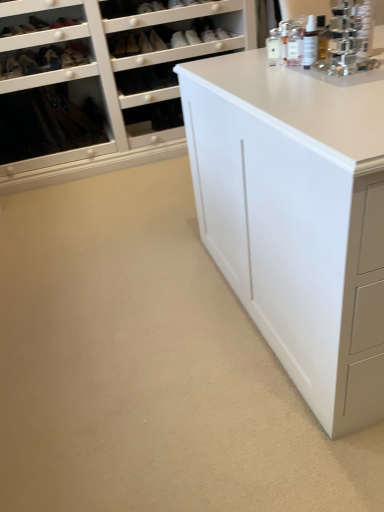
Where is `matte black shoe at upper left, the 1th shoe from the left`? matte black shoe at upper left, the 1th shoe from the left is located at coordinates (28, 63).

This screenshot has width=384, height=512. Describe the element at coordinates (28, 63) in the screenshot. I see `matte black shoe at upper left, the 1th shoe from the left` at that location.

Image resolution: width=384 pixels, height=512 pixels. In order to click on matte black shoe at upper left, the second shoe in the right-to-left sequence in this screenshot , I will do `click(77, 54)`.

At what (x,y) coordinates should I click in order to perform the action: click on clear plastic spray bottle at upper right, the second toiletry from the back. Please return your answer as a coordinate pair (x, y). This screenshot has width=384, height=512. Looking at the image, I should click on (310, 42).

Find the location of a particular element. The height and width of the screenshot is (512, 384). white glass bottle at upper right, arranged as the first toiletry when viewed from the left is located at coordinates (274, 47).

Is white glass bottle at upper right, acting as the first toiletry starting from the back, thinner than matte black shoe at upper left, the 2th shoe positioned from the left?

Correct, the width of white glass bottle at upper right, acting as the first toiletry starting from the back, is less than that of matte black shoe at upper left, the 2th shoe positioned from the left.

The height and width of the screenshot is (512, 384). I want to click on the 2nd shoe counting from the left of the white glass bottle at upper right, which is the second toiletry in right-to-left order, so click(77, 54).

Considering the sizes of objects white glass bottle at upper right, arranged as the first toiletry when viewed from the left, and matte black shoe at upper left, the second shoe in the right-to-left sequence, in the image provided, who is bigger, white glass bottle at upper right, arranged as the first toiletry when viewed from the left, or matte black shoe at upper left, the second shoe in the right-to-left sequence,?

Bigger between the two is matte black shoe at upper left, the second shoe in the right-to-left sequence.

Is point (277, 56) closer to viewer compared to point (64, 54)?

Yes, point (277, 56) is closer to viewer.

Between matte black shoe at upper left, the second shoe in the right-to-left sequence, and matte black shoe at upper left, the 1th shoe from the left, which one has larger width?

matte black shoe at upper left, the 1th shoe from the left.

Is matte black shoe at upper left, the 1th shoe from the left, surrounded by matte black shoe at upper left, the second shoe in the right-to-left sequence?

No, matte black shoe at upper left, the 1th shoe from the left, is not a part of matte black shoe at upper left, the second shoe in the right-to-left sequence.

What's the angular difference between matte black shoe at upper left, the second shoe in the right-to-left sequence, and matte black shoe at upper left, the 1th shoe from the left,'s facing directions?

2.57 degrees.

Looking at this image, is matte black shoe at upper left, the second shoe in the right-to-left sequence, not close to matte black shoe at upper left, the 1th shoe from the left?

No, there isn't a large distance between matte black shoe at upper left, the second shoe in the right-to-left sequence, and matte black shoe at upper left, the 1th shoe from the left.

Between point (29, 68) and point (278, 30), which one is positioned in front?

The point (278, 30) is in front.

Is matte black shoe at upper left, the 3th shoe viewed from the right, next to white glass bottle at upper right, acting as the first toiletry starting from the back, and touching it?

They are not placed beside each other.

Which object is wider, matte black shoe at upper left, the 1th shoe from the left, or white glass bottle at upper right, arranged as the first toiletry when viewed from the left?

matte black shoe at upper left, the 1th shoe from the left, is wider.

From a real-world perspective, count 1st shoes downward from the white glass bottle at upper right, acting as the first toiletry starting from the back, and point to it. Please provide its 2D coordinates.

[(28, 63)]

Between matte black shoe at upper left, the second shoe in the right-to-left sequence, and clear plastic spray bottle at upper right, the second toiletry from the back, which one has smaller size?

With smaller size is clear plastic spray bottle at upper right, the second toiletry from the back.

Is matte black shoe at upper left, the second shoe in the right-to-left sequence, positioned with its back to clear plastic spray bottle at upper right, the second toiletry from the back?

No, clear plastic spray bottle at upper right, the second toiletry from the back, is not at the back of matte black shoe at upper left, the second shoe in the right-to-left sequence.

Which point is more distant from viewer, (x=86, y=50) or (x=317, y=38)?

The point (x=86, y=50) is behind.

Is matte black shoe at upper left, the second shoe in the right-to-left sequence, with clear plastic spray bottle at upper right, which is the 1th toiletry in right-to-left order?

No, matte black shoe at upper left, the second shoe in the right-to-left sequence, is not next to clear plastic spray bottle at upper right, which is the 1th toiletry in right-to-left order.

From the image's perspective, count 1st shoes downward from the matte black shoe at upper center, positioned as the third shoe in left-to-right order, and point to it. Please provide its 2D coordinates.

[(77, 54)]

Between matte black shoe at upper left, the second shoe in the right-to-left sequence, and matte black shoe at upper center, arranged as the 1th shoe when viewed from the right, which one has larger size?

matte black shoe at upper left, the second shoe in the right-to-left sequence.

Are matte black shoe at upper left, the second shoe in the right-to-left sequence, and matte black shoe at upper center, arranged as the 1th shoe when viewed from the right, beside each other?

No, matte black shoe at upper left, the second shoe in the right-to-left sequence, is not making contact with matte black shoe at upper center, arranged as the 1th shoe when viewed from the right.

Who is shorter, matte black shoe at upper left, the second shoe in the right-to-left sequence, or matte black shoe at upper center, positioned as the third shoe in left-to-right order?

matte black shoe at upper center, positioned as the third shoe in left-to-right order, is shorter.

From the image's perspective, is white glass bottle at upper right, which is the second toiletry in right-to-left order, located beneath matte black shoe at upper left, the 1th shoe from the left?

Yes, from the image's perspective, white glass bottle at upper right, which is the second toiletry in right-to-left order, is below matte black shoe at upper left, the 1th shoe from the left.

Between white glass bottle at upper right, acting as the first toiletry starting from the back, and matte black shoe at upper left, the 1th shoe from the left, which one has larger size?

matte black shoe at upper left, the 1th shoe from the left.

Can you see white glass bottle at upper right, acting as the first toiletry starting from the back, touching matte black shoe at upper left, the 1th shoe from the left?

No, white glass bottle at upper right, acting as the first toiletry starting from the back, is not making contact with matte black shoe at upper left, the 1th shoe from the left.

Is point (273, 30) positioned after point (24, 59)?

No, it is in front of (24, 59).

The height and width of the screenshot is (512, 384). Find the location of `shoe that appears in front of the matte black shoe at upper center, arranged as the 1th shoe when viewed from the right`. shoe that appears in front of the matte black shoe at upper center, arranged as the 1th shoe when viewed from the right is located at coordinates (28, 63).

How many degrees apart are the facing directions of matte black shoe at upper center, arranged as the 1th shoe when viewed from the right, and matte black shoe at upper left, the 3th shoe viewed from the right?

They differ by 2.68 degrees in their facing directions.

Is matte black shoe at upper center, positioned as the third shoe in left-to-right order, oriented towards matte black shoe at upper left, the 1th shoe from the left?

No, matte black shoe at upper center, positioned as the third shoe in left-to-right order, is not oriented towards matte black shoe at upper left, the 1th shoe from the left.

Does point (149, 5) come farther from viewer compared to point (27, 72)?

No.

Identify the location of toiletry that is the 1st object to the right of the matte black shoe at upper left, the 2th shoe positioned from the left, starting at the anchor. (274, 47).

Starting from the matte black shoe at upper left, the 2th shoe positioned from the left, which shoe is the 2nd one in front? Please provide its 2D coordinates.

[(28, 63)]

Which object lies further to the anchor point matte black shoe at upper center, arranged as the 1th shoe when viewed from the right, clear plastic spray bottle at upper right, which is the 1th toiletry in right-to-left order, or matte black shoe at upper left, the second shoe in the right-to-left sequence?

clear plastic spray bottle at upper right, which is the 1th toiletry in right-to-left order, is positioned further to the anchor matte black shoe at upper center, arranged as the 1th shoe when viewed from the right.

Which object lies nearer to the anchor point matte black shoe at upper center, arranged as the 1th shoe when viewed from the right, clear plastic spray bottle at upper right, the second toiletry from the back, or white glass bottle at upper right, the second toiletry viewed from the front?

Based on the image, white glass bottle at upper right, the second toiletry viewed from the front, appears to be nearer to matte black shoe at upper center, arranged as the 1th shoe when viewed from the right.

Estimate the real-world distances between objects in this image. Which object is closer to white glass bottle at upper right, arranged as the first toiletry when viewed from the left, matte black shoe at upper left, the 3th shoe viewed from the right, or matte black shoe at upper left, the 2th shoe positioned from the left?

matte black shoe at upper left, the 2th shoe positioned from the left, lies closer to white glass bottle at upper right, arranged as the first toiletry when viewed from the left, than the other object.

From the image, which object appears to be nearer to clear plastic spray bottle at upper right, which is the 1th toiletry in right-to-left order, matte black shoe at upper left, the 3th shoe viewed from the right, or matte black shoe at upper left, the second shoe in the right-to-left sequence?

Based on the image, matte black shoe at upper left, the second shoe in the right-to-left sequence, appears to be nearer to clear plastic spray bottle at upper right, which is the 1th toiletry in right-to-left order.

Considering their positions, is matte black shoe at upper left, the 1th shoe from the left, positioned further to clear plastic spray bottle at upper right, which is counted as the 1th toiletry, starting from the front, than white glass bottle at upper right, arranged as the first toiletry when viewed from the left?

Among the two, matte black shoe at upper left, the 1th shoe from the left, is located further to clear plastic spray bottle at upper right, which is counted as the 1th toiletry, starting from the front.

From the image, which object appears to be farther from matte black shoe at upper center, arranged as the 1th shoe when viewed from the right, matte black shoe at upper left, the second shoe in the right-to-left sequence, or matte black shoe at upper left, the 1th shoe from the left?

The object further to matte black shoe at upper center, arranged as the 1th shoe when viewed from the right, is matte black shoe at upper left, the 1th shoe from the left.

From the image, which object appears to be farther from matte black shoe at upper left, the 3th shoe viewed from the right, white glass bottle at upper right, the second toiletry viewed from the front, or clear plastic spray bottle at upper right, the second toiletry from the back?

clear plastic spray bottle at upper right, the second toiletry from the back, is further to matte black shoe at upper left, the 3th shoe viewed from the right.

Based on the photo, looking at the image, which one is located closer to matte black shoe at upper center, arranged as the 1th shoe when viewed from the right, matte black shoe at upper left, the second shoe in the right-to-left sequence, or clear plastic spray bottle at upper right, which is the second toiletry in left-to-right order?

matte black shoe at upper left, the second shoe in the right-to-left sequence, is positioned closer to the anchor matte black shoe at upper center, arranged as the 1th shoe when viewed from the right.

Locate an element on the screen. shoe between clear plastic spray bottle at upper right, which is counted as the 1th toiletry, starting from the front, and matte black shoe at upper center, arranged as the 1th shoe when viewed from the right, in the front-back direction is located at coordinates (28, 63).

The height and width of the screenshot is (512, 384). Identify the location of toiletry located between clear plastic spray bottle at upper right, which is the 1th toiletry in right-to-left order, and matte black shoe at upper center, arranged as the 1th shoe when viewed from the right, in the depth direction. (274, 47).

Identify the location of toiletry positioned between clear plastic spray bottle at upper right, the second toiletry from the back, and matte black shoe at upper left, the 2th shoe positioned from the left, from near to far. (274, 47).

Locate an element on the screen. shoe located between white glass bottle at upper right, arranged as the first toiletry when viewed from the left, and matte black shoe at upper center, positioned as the third shoe in left-to-right order, in the depth direction is located at coordinates (28, 63).